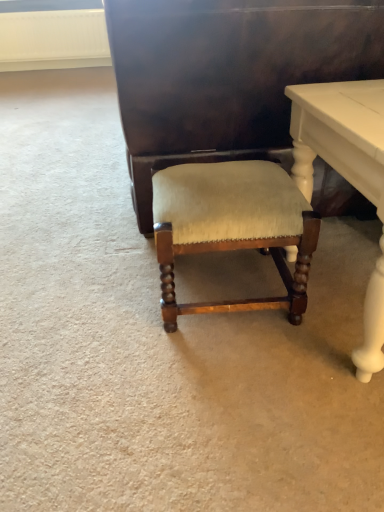
Question: From the image's perspective, is white glossy table at lower right under suede-like beige cushion at center?

Choices:
 (A) no
 (B) yes

Answer: (A)

Question: Is white glossy table at lower right outside suede-like beige cushion at center?

Choices:
 (A) no
 (B) yes

Answer: (B)

Question: Is the depth of white glossy table at lower right greater than that of suede-like beige cushion at center?

Choices:
 (A) no
 (B) yes

Answer: (A)

Question: Considering the relative sizes of white glossy table at lower right and suede-like beige cushion at center in the image provided, is white glossy table at lower right shorter than suede-like beige cushion at center?

Choices:
 (A) no
 (B) yes

Answer: (A)

Question: Would you say white glossy table at lower right contains suede-like beige cushion at center?

Choices:
 (A) yes
 (B) no

Answer: (B)

Question: From a real-world perspective, is white glossy table at lower right physically above suede-like beige cushion at center?

Choices:
 (A) no
 (B) yes

Answer: (B)

Question: From the image's perspective, is suede-like beige cushion at center located above white glossy table at lower right?

Choices:
 (A) no
 (B) yes

Answer: (A)

Question: From the image's perspective, is suede-like beige cushion at center located beneath white glossy table at lower right?

Choices:
 (A) no
 (B) yes

Answer: (B)

Question: Is the position of suede-like beige cushion at center less distant than that of white glossy table at lower right?

Choices:
 (A) yes
 (B) no

Answer: (B)

Question: Does suede-like beige cushion at center have a lesser width compared to white glossy table at lower right?

Choices:
 (A) yes
 (B) no

Answer: (A)

Question: Is suede-like beige cushion at center not close to white glossy table at lower right?

Choices:
 (A) no
 (B) yes

Answer: (A)

Question: Is suede-like beige cushion at center facing away from white glossy table at lower right?

Choices:
 (A) yes
 (B) no

Answer: (A)

Question: From a real-world perspective, is shiny dark wood vanity at center below white glossy table at lower right?

Choices:
 (A) yes
 (B) no

Answer: (B)